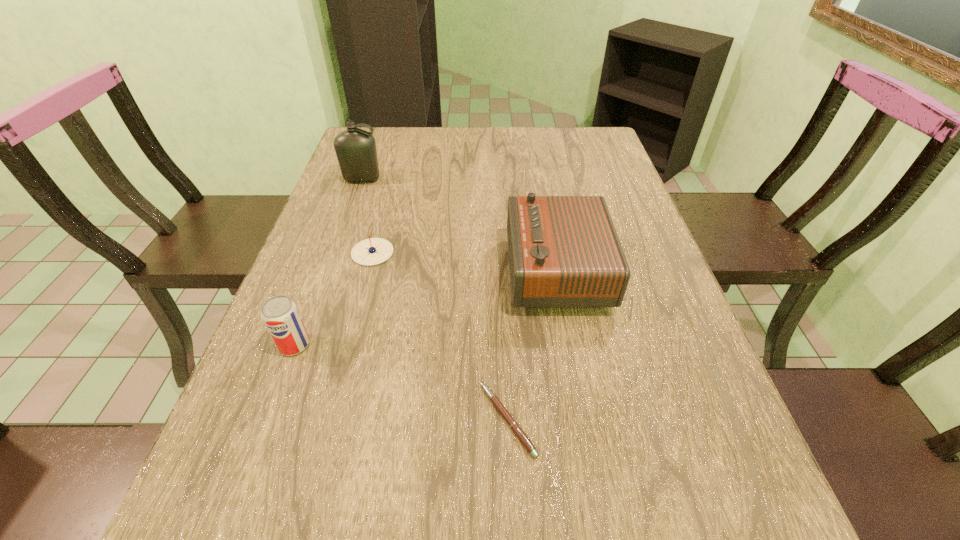
Identify the location of vacant area between the fourth tallest object and the shortest object. This screenshot has height=540, width=960. (440, 336).

Locate an element on the screen. The width and height of the screenshot is (960, 540). vacant area that lies between the fourth farthest object and the farthest object is located at coordinates (328, 262).

Image resolution: width=960 pixels, height=540 pixels. What are the coordinates of `free point between the second tallest object and the third tallest object` in the screenshot? It's located at pyautogui.click(x=425, y=308).

This screenshot has width=960, height=540. I want to click on unoccupied area between the tallest object and the second shortest object, so click(368, 216).

At what (x,y) coordinates should I click in order to perform the action: click on empty space that is in between the bottle and the second shortest object. Please return your answer as a coordinate pair (x, y). Image resolution: width=960 pixels, height=540 pixels. Looking at the image, I should click on (368, 216).

Where is `the second closest object relative to the soda`? the second closest object relative to the soda is located at coordinates (514, 426).

The width and height of the screenshot is (960, 540). What are the coordinates of `the fourth closest object to the shortest object` in the screenshot? It's located at (355, 148).

Identify the location of vacant area in the image that satisfies the following two spatial constraints: 1. on the back side of the third tallest object; 2. on the right side of the compass. (329, 253).

Where is `blank area in the image that satisfies the following two spatial constraints: 1. on the front panel of the radio receiver; 2. on the front side of the soda`? The height and width of the screenshot is (540, 960). blank area in the image that satisfies the following two spatial constraints: 1. on the front panel of the radio receiver; 2. on the front side of the soda is located at coordinates (570, 345).

The width and height of the screenshot is (960, 540). What are the coordinates of `vacant space that satisfies the following two spatial constraints: 1. on the front panel of the fourth shortest object; 2. on the front side of the fourth farthest object` in the screenshot? It's located at (570, 345).